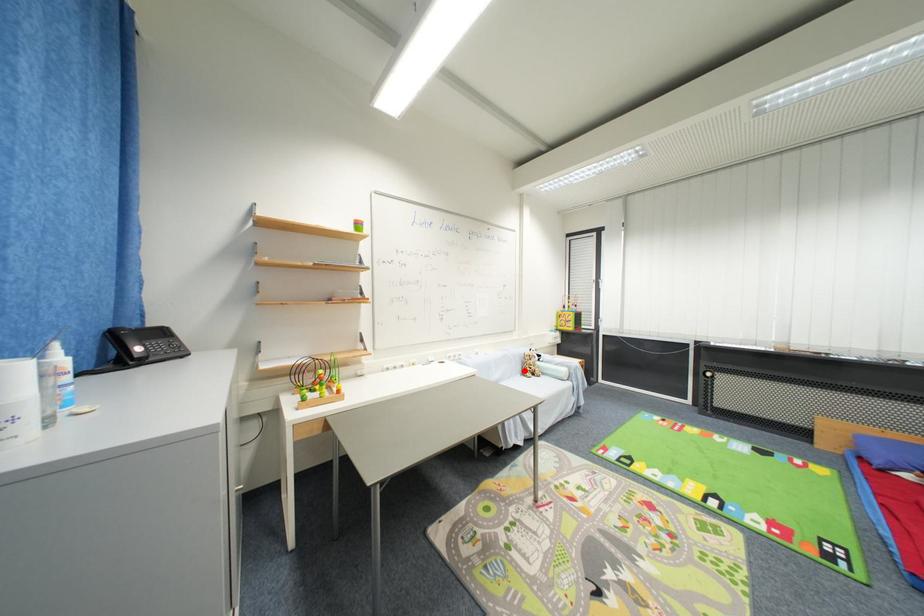
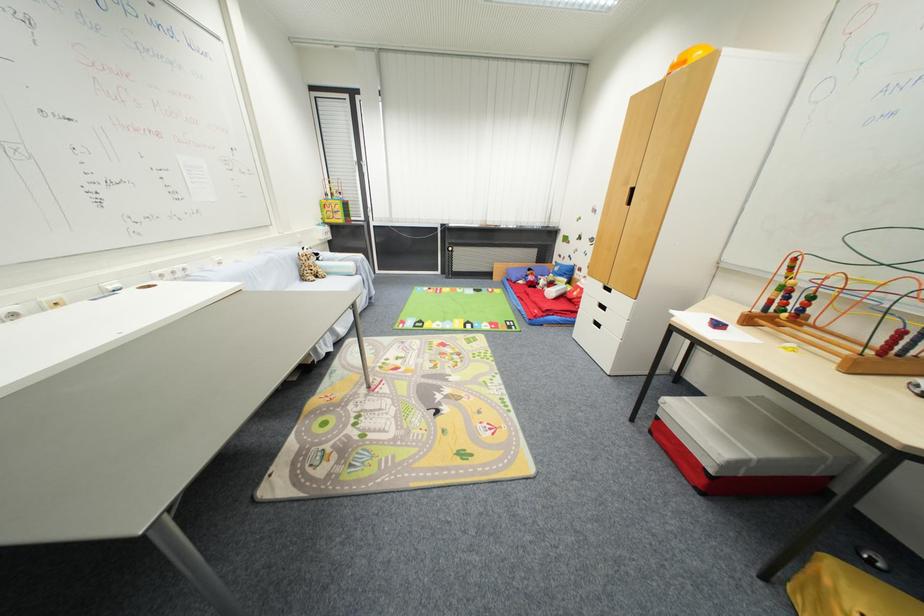
Question: I am providing you with two images of the same scene from different viewpoints. In image1, a red point is highlighted. Considering the same 3D point in image2, which of the following is correct?

Choices:
 (A) It is closer
 (B) It is farther

Answer: (A)